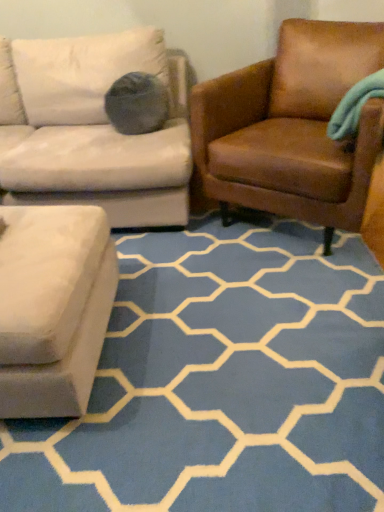
What is the approximate height of blue carpet at lower center?

blue carpet at lower center is 2.20 inches tall.

Image resolution: width=384 pixels, height=512 pixels. In order to click on blue carpet at lower center in this screenshot , I will do `click(222, 382)`.

The image size is (384, 512). What do you see at coordinates (222, 382) in the screenshot?
I see `blue carpet at lower center` at bounding box center [222, 382].

Measure the distance between point (217, 109) and camera.

1.87 meters.

This screenshot has height=512, width=384. What do you see at coordinates (292, 127) in the screenshot? I see `brown leather chair at right` at bounding box center [292, 127].

The image size is (384, 512). In order to click on brown leather chair at right in this screenshot , I will do tap(292, 127).

Where is `blue carpet at lower center`? This screenshot has width=384, height=512. blue carpet at lower center is located at coordinates (222, 382).

Between brown leather chair at right and blue carpet at lower center, which one appears on the left side from the viewer's perspective?

From the viewer's perspective, blue carpet at lower center appears more on the left side.

Is brown leather chair at right in front of blue carpet at lower center?

No, brown leather chair at right is further to the viewer.

Which point is more forward, (272, 79) or (137, 247)?

The point (137, 247) is more forward.

From the image's perspective, is brown leather chair at right positioned above or below blue carpet at lower center?

Based on their image positions, brown leather chair at right is located above blue carpet at lower center.

From a real-world perspective, relative to blue carpet at lower center, is brown leather chair at right vertically above or below?

brown leather chair at right is above blue carpet at lower center.

Can you confirm if brown leather chair at right is thinner than blue carpet at lower center?

Indeed, brown leather chair at right has a lesser width compared to blue carpet at lower center.

Considering the relative sizes of brown leather chair at right and blue carpet at lower center in the image provided, is brown leather chair at right taller than blue carpet at lower center?

Indeed, brown leather chair at right has a greater height compared to blue carpet at lower center.

Does brown leather chair at right have a larger size compared to blue carpet at lower center?

Correct, brown leather chair at right is larger in size than blue carpet at lower center.

Is brown leather chair at right positioned beyond the bounds of blue carpet at lower center?

Yes, brown leather chair at right is not within blue carpet at lower center.

Is brown leather chair at right next to blue carpet at lower center and touching it?

No, brown leather chair at right is not next to blue carpet at lower center.

Is brown leather chair at right turned away from blue carpet at lower center?

No, brown leather chair at right is not facing away from blue carpet at lower center.

Can you tell me how much brown leather chair at right and blue carpet at lower center differ in facing direction?

They differ by 146 degrees in their facing directions.

How much distance is there between brown leather chair at right and blue carpet at lower center?

brown leather chair at right and blue carpet at lower center are 24.80 inches apart from each other.

Find the location of a particular element. Image resolution: width=384 pixels, height=512 pixels. pattern that is below the brown leather chair at right (from the image's perspective) is located at coordinates (222, 382).

Is blue carpet at lower center at the right side of brown leather chair at right?

No, blue carpet at lower center is not to the right of brown leather chair at right.

Is blue carpet at lower center in front of brown leather chair at right?

Yes, blue carpet at lower center is closer to the camera.

Does point (159, 403) lie behind point (366, 138)?

That is False.

Looking at this image, from the image's perspective, does blue carpet at lower center appear lower than brown leather chair at right?

Yes, from the image's perspective, blue carpet at lower center is beneath brown leather chair at right.

From a real-world perspective, is blue carpet at lower center above or below brown leather chair at right?

From a real-world perspective, blue carpet at lower center is physically below brown leather chair at right.

Is blue carpet at lower center thinner than brown leather chair at right?

No, blue carpet at lower center is not thinner than brown leather chair at right.

Considering the sizes of objects blue carpet at lower center and brown leather chair at right in the image provided, who is taller, blue carpet at lower center or brown leather chair at right?

Standing taller between the two is brown leather chair at right.

Considering the sizes of objects blue carpet at lower center and brown leather chair at right in the image provided, who is bigger, blue carpet at lower center or brown leather chair at right?

brown leather chair at right is bigger.

Can brown leather chair at right be found inside blue carpet at lower center?

No, brown leather chair at right is not surrounded by blue carpet at lower center.

Is blue carpet at lower center far from brown leather chair at right?

That's not correct — blue carpet at lower center is a little close to brown leather chair at right.

Is blue carpet at lower center facing away from brown leather chair at right?

blue carpet at lower center does not have its back to brown leather chair at right.

Can you tell me how much blue carpet at lower center and brown leather chair at right differ in facing direction?

blue carpet at lower center and brown leather chair at right are facing 146 degrees away from each other.

The width and height of the screenshot is (384, 512). Find the location of `chair above the blue carpet at lower center (from a real-world perspective)`. chair above the blue carpet at lower center (from a real-world perspective) is located at coordinates (292, 127).

You are a GUI agent. You are given a task and a screenshot of the screen. Output one action in this format:
    pyautogui.click(x=<x>, y=<y>)
    Task: Click on the pattern below the brown leather chair at right (from a real-world perspective)
    This screenshot has width=384, height=512.
    Given the screenshot: What is the action you would take?
    pyautogui.click(x=222, y=382)

Where is `pattern lying on the left of brown leather chair at right`? pattern lying on the left of brown leather chair at right is located at coordinates (222, 382).